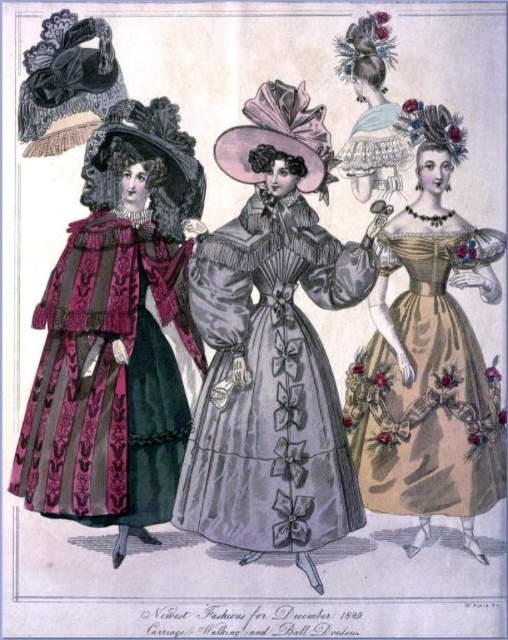
Question: Is velvet-like burgundy dress at left positioned behind matte gold dress at right?

Choices:
 (A) no
 (B) yes

Answer: (A)

Question: Based on their relative distances, which object is farther from the matte silver tiara at upper center?

Choices:
 (A) velvet-like burgundy dress at left
 (B) silvery satin dress at center
 (C) matte gold dress at right

Answer: (A)

Question: Which point is closer to the camera taking this photo?

Choices:
 (A) (503, 234)
 (B) (344, 172)
 (C) (183, 417)

Answer: (C)

Question: In this image, where is silvery satin dress at center located relative to matte gold dress at right?

Choices:
 (A) left
 (B) right

Answer: (A)

Question: Which point is farther from the camera taking this photo?

Choices:
 (A) (375, 476)
 (B) (69, 465)

Answer: (A)

Question: Does silvery satin dress at center have a lesser width compared to matte silver tiara at upper center?

Choices:
 (A) no
 (B) yes

Answer: (A)